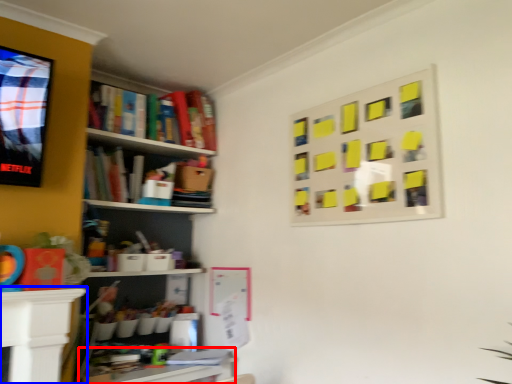
Question: Which point is further to the camera, table (highlighted by a red box) or table (highlighted by a blue box)?

Choices:
 (A) table
 (B) table

Answer: (A)